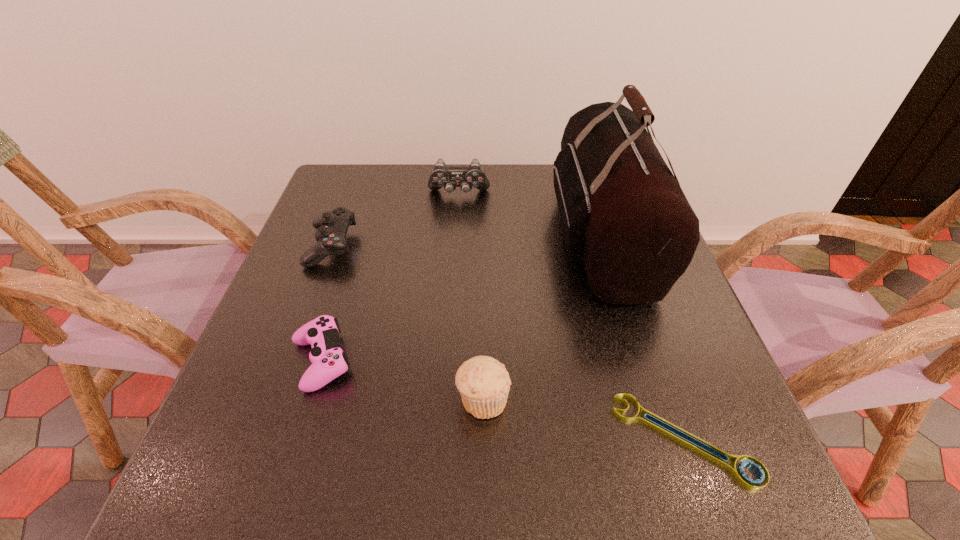
Identify the location of free space located on the front pocket of the duffel bag. The width and height of the screenshot is (960, 540). (417, 236).

Identify the location of free space located 0.310m on the front pocket of the duffel bag. (x=428, y=236).

Identify the location of free space located 0.270m on the surface of the rightmost control with buttons. (454, 270).

The width and height of the screenshot is (960, 540). In order to click on blank area located 0.290m on the right of the muffin in this screenshot , I will do `click(676, 399)`.

I want to click on vacant space located on the back of the second shortest control, so click(352, 190).

Where is `vacant space positioned 0.090m on the right of the nearest control`? vacant space positioned 0.090m on the right of the nearest control is located at coordinates (403, 360).

The height and width of the screenshot is (540, 960). Identify the location of vacant space located on the back of the wrench. (619, 251).

Locate an element on the screen. Image resolution: width=960 pixels, height=540 pixels. duffel bag that is at the far edge is located at coordinates (624, 216).

Find the location of a particular element. The height and width of the screenshot is (540, 960). control that is at the far edge is located at coordinates (449, 177).

Where is `object at the near edge`? The height and width of the screenshot is (540, 960). object at the near edge is located at coordinates (739, 474).